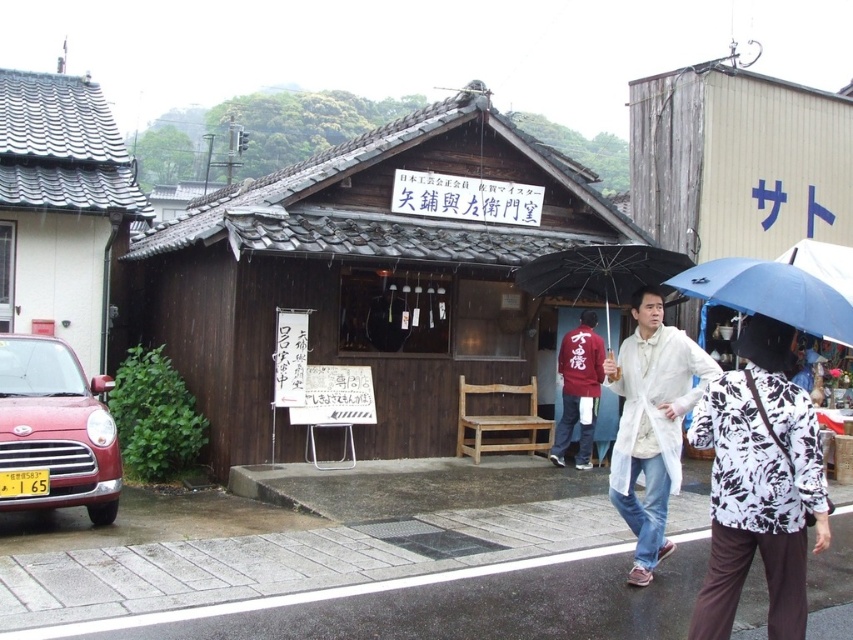
Question: Does brown wooden hut at center appear on the right side of wooden hut at upper right?

Choices:
 (A) no
 (B) yes

Answer: (A)

Question: Is matte white wall at left above white floral blouse at center?

Choices:
 (A) yes
 (B) no

Answer: (A)

Question: Which point is closer to the camera taking this photo?

Choices:
 (A) (410, 397)
 (B) (566, 282)
 (C) (109, 241)

Answer: (B)

Question: Does white matte coat at center have a smaller size compared to blue matte umbrella at center?

Choices:
 (A) yes
 (B) no

Answer: (B)

Question: Which point is closer to the camera?

Choices:
 (A) (769, 150)
 (B) (779, 529)

Answer: (B)

Question: Based on their relative distances, which object is farther from the brown wooden hut at center?

Choices:
 (A) shiny red car at lower left
 (B) white floral blouse at center
 (C) blue matte umbrella at center
 (D) matte white wall at left

Answer: (C)